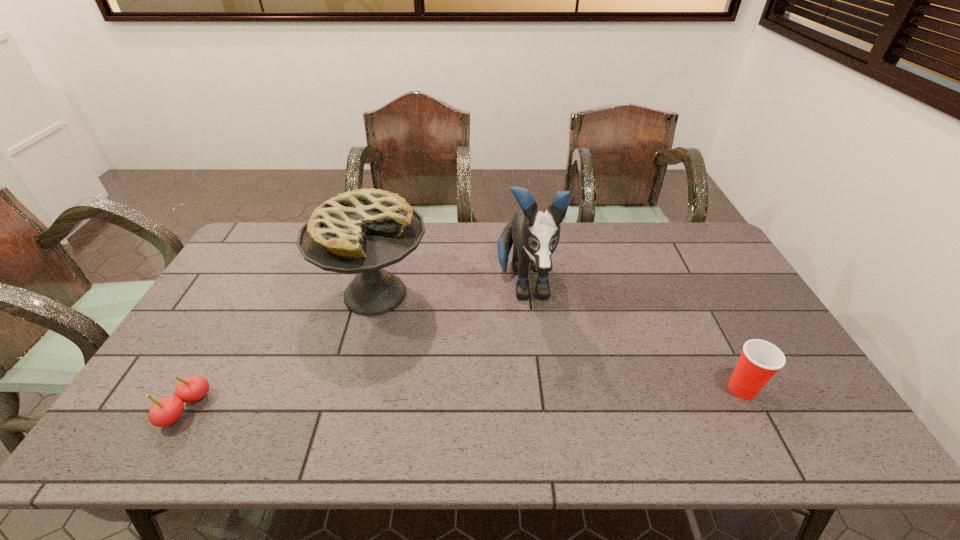
Identify the location of free space on the desktop that is between the shortest object and the rightmost object and is positioned on the cut side of the second tallest object. (411, 401).

Locate an element on the screen. The height and width of the screenshot is (540, 960). free space on the desktop that is between the shortest object and the rightmost object and is positioned on the front-facing side of the second object from right to left is located at coordinates (541, 396).